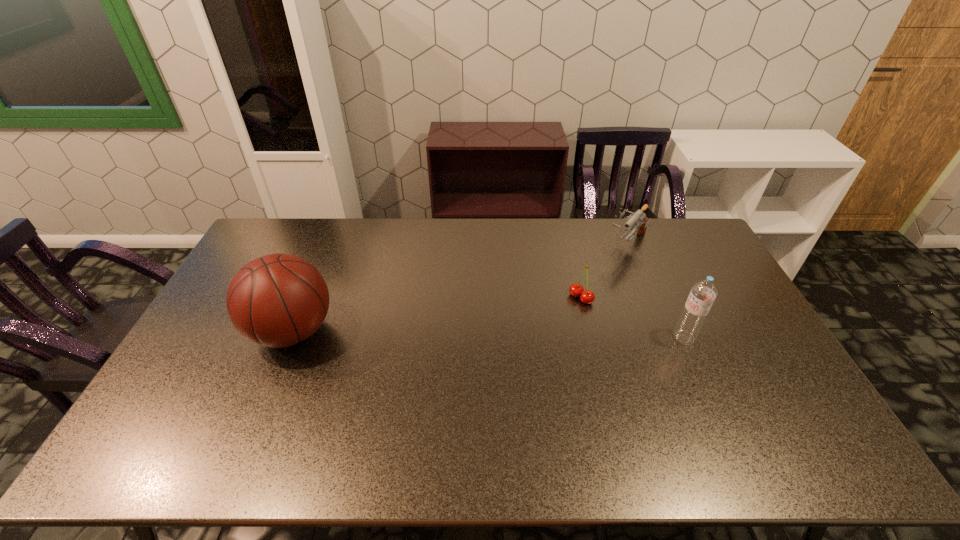
The height and width of the screenshot is (540, 960). What are the coordinates of `the closest object relative to the water bottle` in the screenshot? It's located at (586, 296).

Find the location of a particular element. This screenshot has height=540, width=960. vacant space that satisfies the following two spatial constraints: 1. on the back side of the gun; 2. on the right side of the leftmost object is located at coordinates (328, 245).

Locate an element on the screen. The height and width of the screenshot is (540, 960). vacant position in the image that satisfies the following two spatial constraints: 1. on the front side of the water bottle; 2. on the right side of the second object from left to right is located at coordinates (590, 338).

At what (x,y) coordinates should I click in order to perform the action: click on vacant space that satisfies the following two spatial constraints: 1. on the back side of the third object from right to left; 2. on the left side of the farthest object. Please return your answer as a coordinate pair (x, y). The width and height of the screenshot is (960, 540). Looking at the image, I should click on (568, 245).